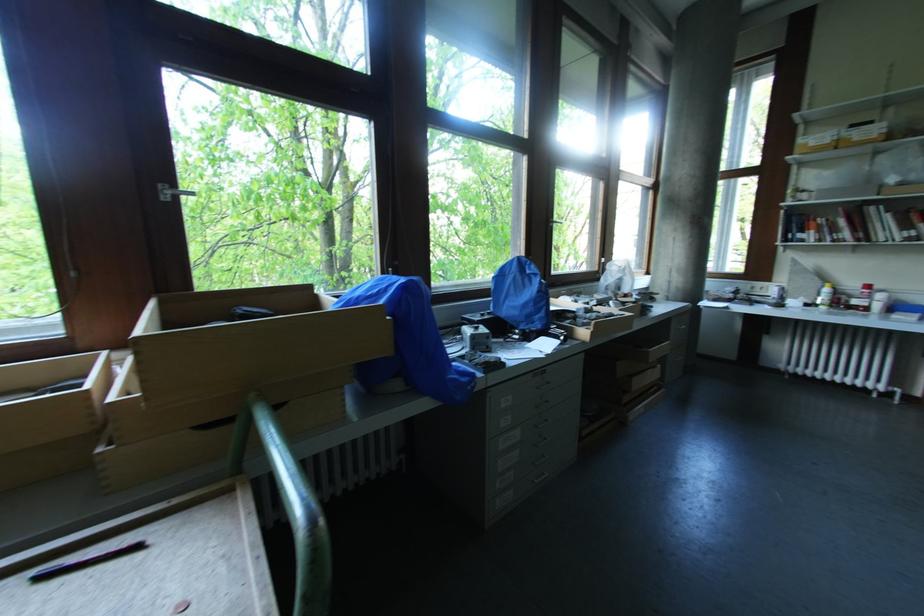
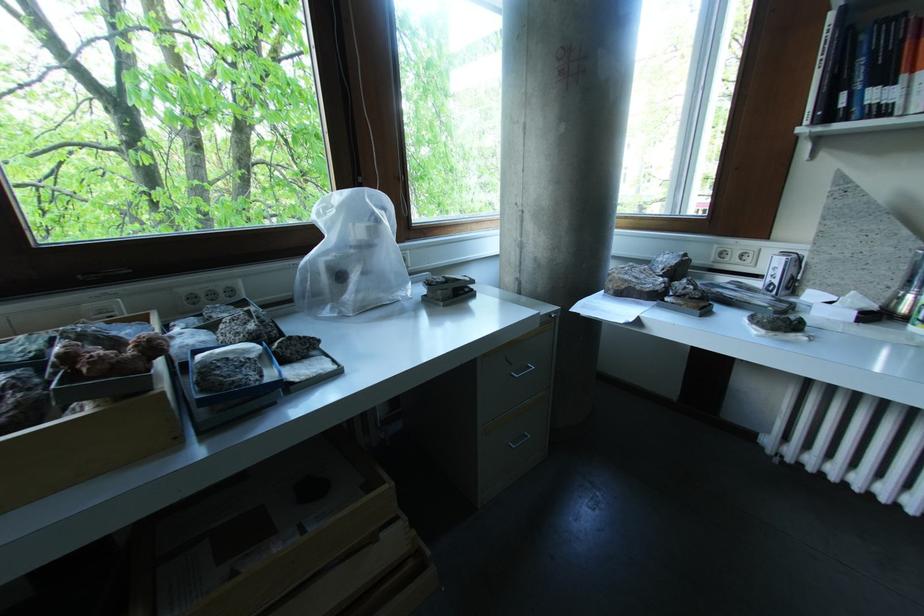
Which direction would the cameraman need to move to produce the second image?

The cameraman walked toward right, forward.